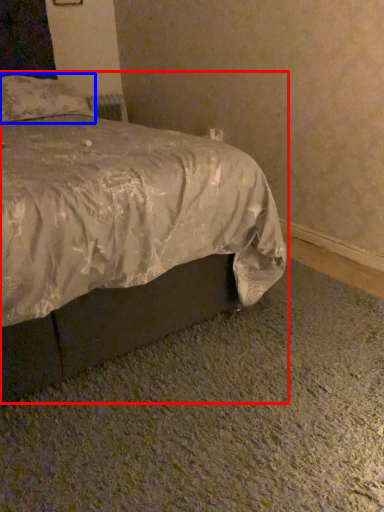
Question: Among these objects, which one is nearest to the camera, bed (highlighted by a red box) or pillow (highlighted by a blue box)?

Choices:
 (A) bed
 (B) pillow

Answer: (A)